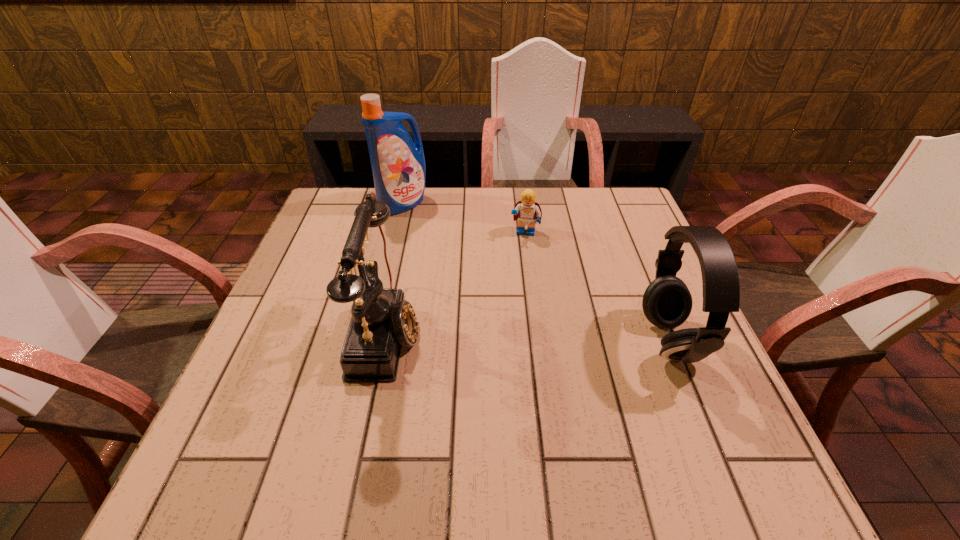
Image resolution: width=960 pixels, height=540 pixels. I want to click on telephone, so click(x=382, y=321).

Where is `earphone`? earphone is located at coordinates (667, 302).

Find the location of a particular element. Lego is located at coordinates point(527,210).

At what (x,y) coordinates should I click in order to perform the action: click on the third object from left to right. Please return your answer as a coordinate pair (x, y). Image resolution: width=960 pixels, height=540 pixels. Looking at the image, I should click on (527, 210).

The image size is (960, 540). Find the location of `detergent`. detergent is located at coordinates (398, 165).

You are a GUI agent. You are given a task and a screenshot of the screen. Output one action in this format:
    pyautogui.click(x=<x>, y=<y>)
    Task: Click on the vacant space located on the dial of the telephone
    
    Given the screenshot: What is the action you would take?
    pyautogui.click(x=551, y=332)

The image size is (960, 540). I want to click on free space located on the ear cups of the earphone, so click(577, 340).

This screenshot has width=960, height=540. In order to click on vacant space located 0.390m on the ear cups of the earphone in this screenshot , I will do `click(457, 340)`.

Where is `vacant space located 0.160m on the ear cups of the earphone`? This screenshot has width=960, height=540. vacant space located 0.160m on the ear cups of the earphone is located at coordinates (567, 340).

Image resolution: width=960 pixels, height=540 pixels. I want to click on vacant space located 0.320m on the front-facing side of the third object from left to right, so click(x=508, y=329).